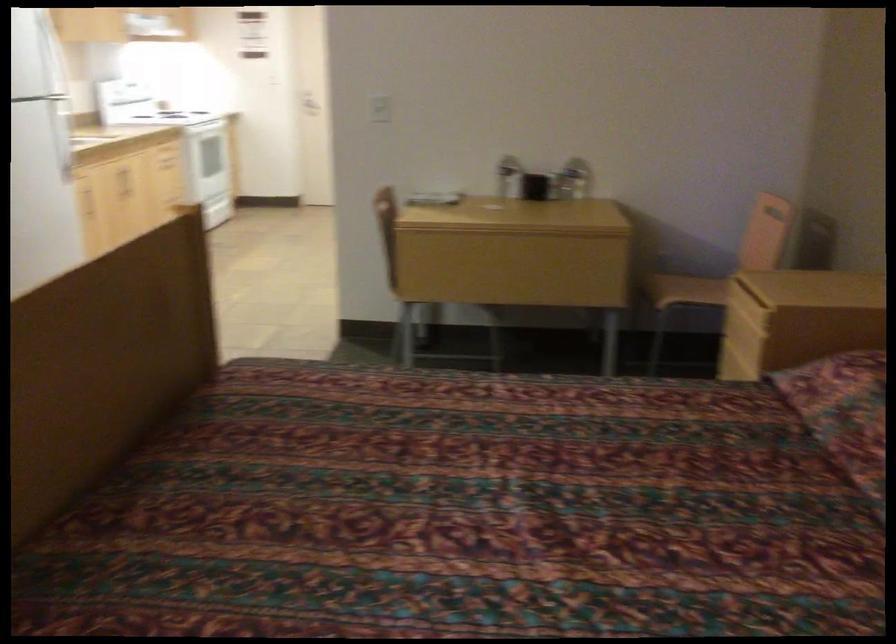
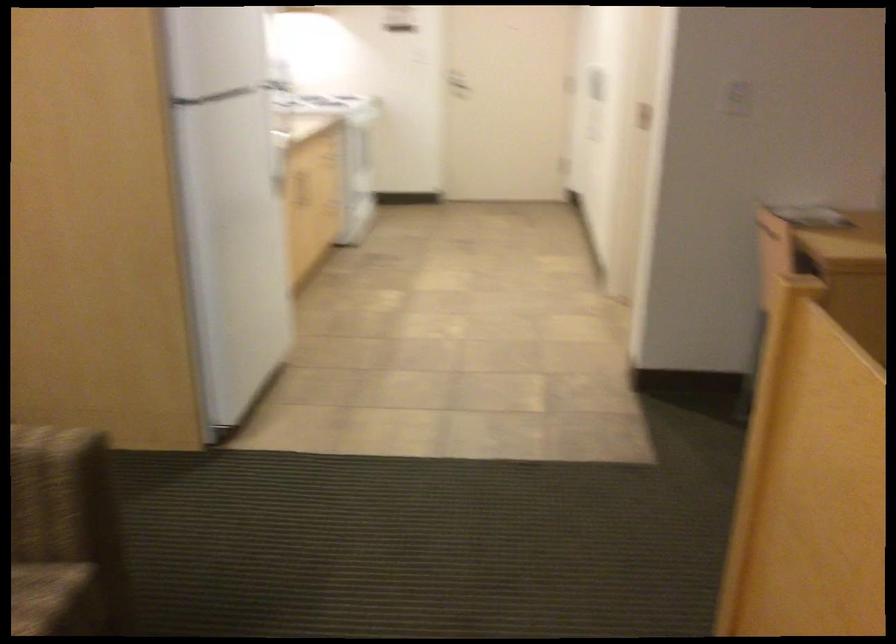
Find the pixel in the second image that matches point (288, 98) in the first image.

(455, 84)